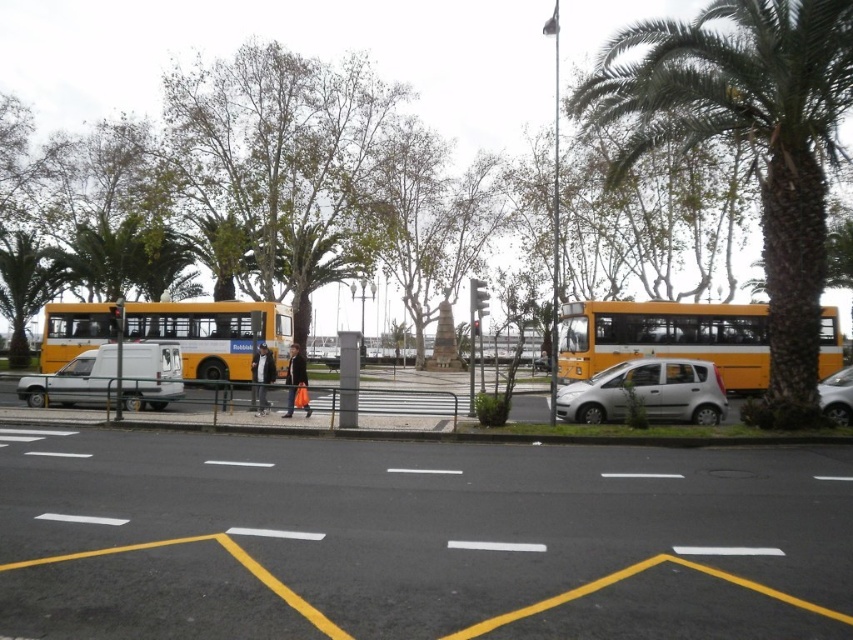
Question: Can you confirm if yellow matte bus at left is smaller than silver metallic sedan at right?

Choices:
 (A) no
 (B) yes

Answer: (A)

Question: Estimate the real-world distances between objects in this image. Which object is farther from the silver metallic sedan at right?

Choices:
 (A) yellow matte bus at right
 (B) yellow asphalt parking lot at center
 (C) green leafy palm tree at right

Answer: (B)

Question: Is yellow matte bus at left positioned in front of silver metallic van at left?

Choices:
 (A) yes
 (B) no

Answer: (B)

Question: Which point appears farthest from the camera in this image?

Choices:
 (A) (836, 419)
 (B) (642, 387)
 (C) (827, 499)
 (D) (761, 384)

Answer: (D)

Question: Can you confirm if yellow asphalt parking lot at center is positioned to the right of silver metallic sedan at right?

Choices:
 (A) yes
 (B) no

Answer: (B)

Question: Based on their relative distances, which object is nearer to the yellow matte bus at left?

Choices:
 (A) silver metallic van at left
 (B) silver metallic sedan at right
 (C) green leafy palm tree at right
 (D) yellow matte bus at right

Answer: (A)